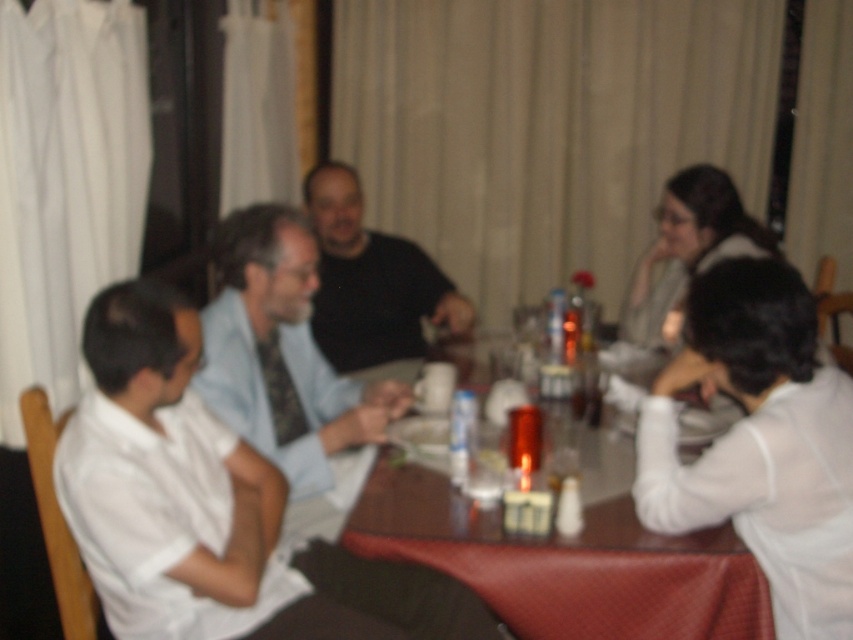
You are a photographer trying to capture a group photo of the people at the dining table. You notice the white shirt at center and the blue textured shirt at center. Which shirt should you adjust to ensure both are fully visible in the photo?

The white shirt at center is positioned under the blue textured shirt at center, so you should adjust the blue textured shirt at center to move it slightly back or up to avoid blocking the white shirt at center.

You are taking a photo of the dining table and want to focus on both the point at coordinates (437,593) and the point at coordinates (364,240). Which point should you adjust your camera focus to prioritize for better clarity?

You should prioritize focusing on point (364,240) because it is farther from the camera compared to point (437,593), which is closer. To ensure both points are in focus, focus on the farther point first.

You are a server at a restaurant and need to deliver a dessert plate to the table. The dessert plate is 12 inches in diameter. You want to place it between the white shirt at center and the blue textured shirt at center. Will there be enough space between them to fit the dessert plate?

The white shirt at center and blue textured shirt at center are 13.10 inches apart, so yes, the dessert plate with 12 inches diameter can fit between them since the space is wider than the plate.